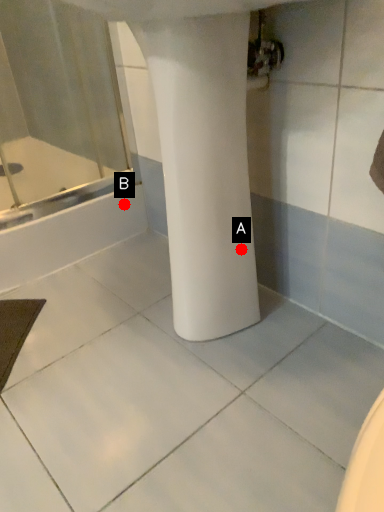
Question: Two points are circled on the image, labeled by A and B beside each circle. Which point is farther from the camera taking this photo?

Choices:
 (A) A is further
 (B) B is further

Answer: (B)